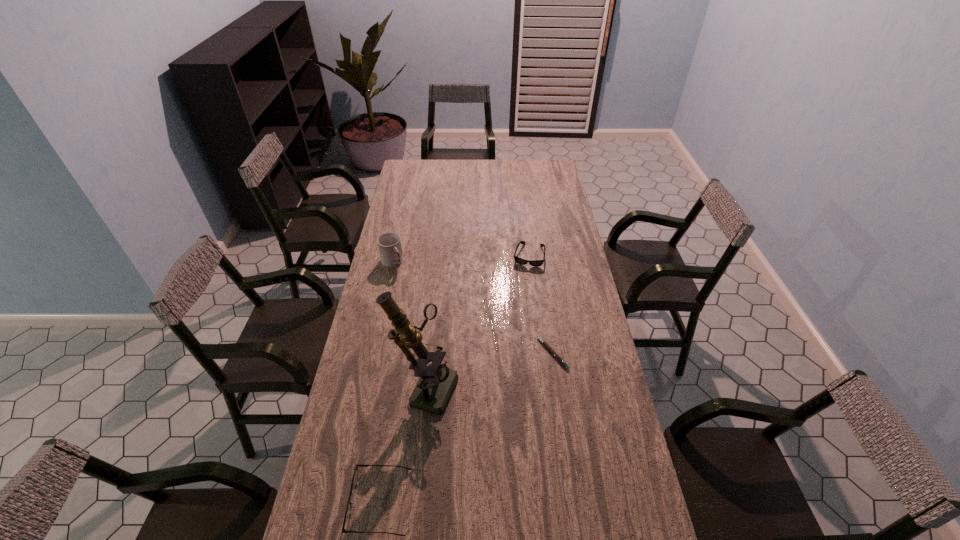
The width and height of the screenshot is (960, 540). I want to click on vacant space that is in between the sunglasses and the pen, so click(540, 304).

Locate an element on the screen. Image resolution: width=960 pixels, height=540 pixels. vacant region between the tallest object and the nearest object is located at coordinates (403, 444).

Image resolution: width=960 pixels, height=540 pixels. In order to click on vacant area that lies between the sunglasses and the shortest object in this screenshot , I will do `click(540, 304)`.

Where is `vacant area that lies between the microscope and the nearest object`? vacant area that lies between the microscope and the nearest object is located at coordinates (403, 444).

The image size is (960, 540). Identify the location of free space between the microscope and the sunglasses. (477, 320).

You are a GUI agent. You are given a task and a screenshot of the screen. Output one action in this format:
    pyautogui.click(x=<x>, y=<y>)
    Task: Click on the vacant space in between the fourth shortest object and the pen
    Image resolution: width=960 pixels, height=540 pixels.
    Given the screenshot: What is the action you would take?
    pyautogui.click(x=472, y=307)

Where is `free space between the spectacles and the pen`? The height and width of the screenshot is (540, 960). free space between the spectacles and the pen is located at coordinates (467, 427).

This screenshot has width=960, height=540. I want to click on the third closest object to the pen, so click(x=355, y=475).

This screenshot has height=540, width=960. Identify the location of object identified as the closest to the sunglasses. (545, 344).

The image size is (960, 540). What are the coordinates of `vacant area in the image that satisfies the following two spatial constraints: 1. on the back side of the cup; 2. on the left side of the sunglasses` in the screenshot? It's located at (394, 255).